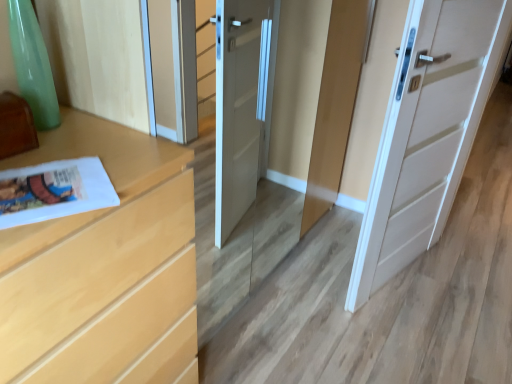
Question: From the image's perspective, is white glossy magazine at lower left below white matte door at center?

Choices:
 (A) yes
 (B) no

Answer: (A)

Question: Does white glossy magazine at lower left have a greater height compared to white matte door at center?

Choices:
 (A) no
 (B) yes

Answer: (A)

Question: From a real-world perspective, does white glossy magazine at lower left stand above white matte door at center?

Choices:
 (A) yes
 (B) no

Answer: (A)

Question: Is the depth of white glossy magazine at lower left greater than that of white matte door at center?

Choices:
 (A) no
 (B) yes

Answer: (A)

Question: Is white glossy magazine at lower left beside white matte door at center?

Choices:
 (A) no
 (B) yes

Answer: (A)

Question: From the image's perspective, is white glossy magazine at lower left over white matte door at center?

Choices:
 (A) yes
 (B) no

Answer: (B)

Question: Is white matte door at center facing away from light wood chest of drawers at left?

Choices:
 (A) yes
 (B) no

Answer: (B)

Question: Can you confirm if white matte door at center is taller than light wood chest of drawers at left?

Choices:
 (A) yes
 (B) no

Answer: (A)

Question: Is white matte door at center further to camera compared to light wood chest of drawers at left?

Choices:
 (A) no
 (B) yes

Answer: (B)

Question: Is white matte door at center smaller than light wood chest of drawers at left?

Choices:
 (A) yes
 (B) no

Answer: (A)

Question: Does white matte door at center come in front of light wood chest of drawers at left?

Choices:
 (A) no
 (B) yes

Answer: (A)

Question: Is white matte door at center shorter than light wood chest of drawers at left?

Choices:
 (A) no
 (B) yes

Answer: (A)

Question: From a real-world perspective, is light wood chest of drawers at left over white glossy magazine at lower left?

Choices:
 (A) yes
 (B) no

Answer: (B)